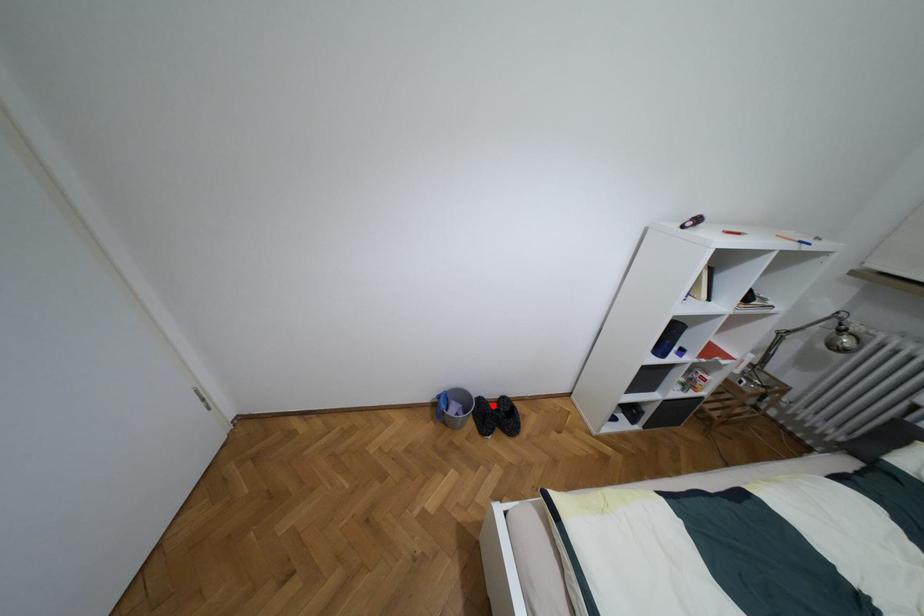
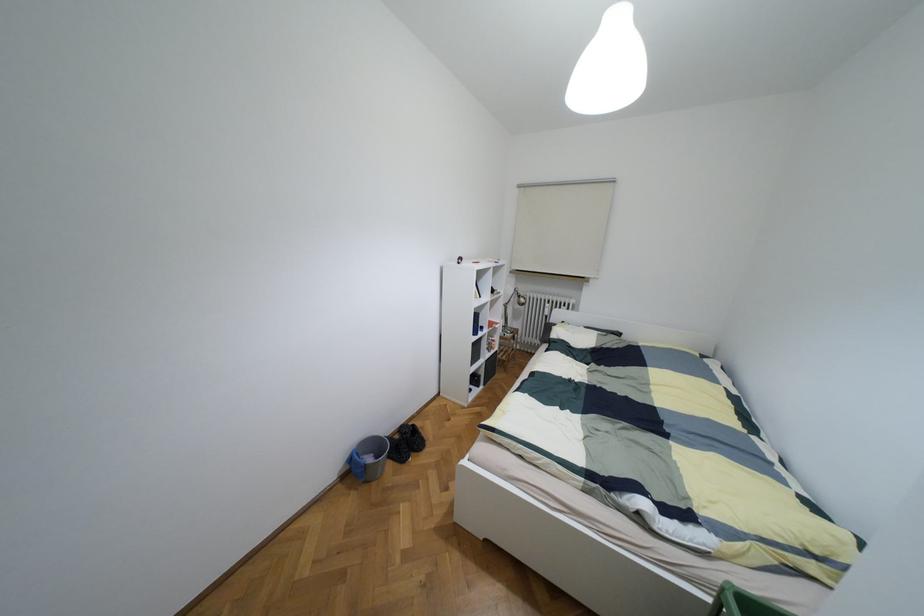
In the second image, find the point that corresponds to the highlighted location in the first image.

(395, 436)